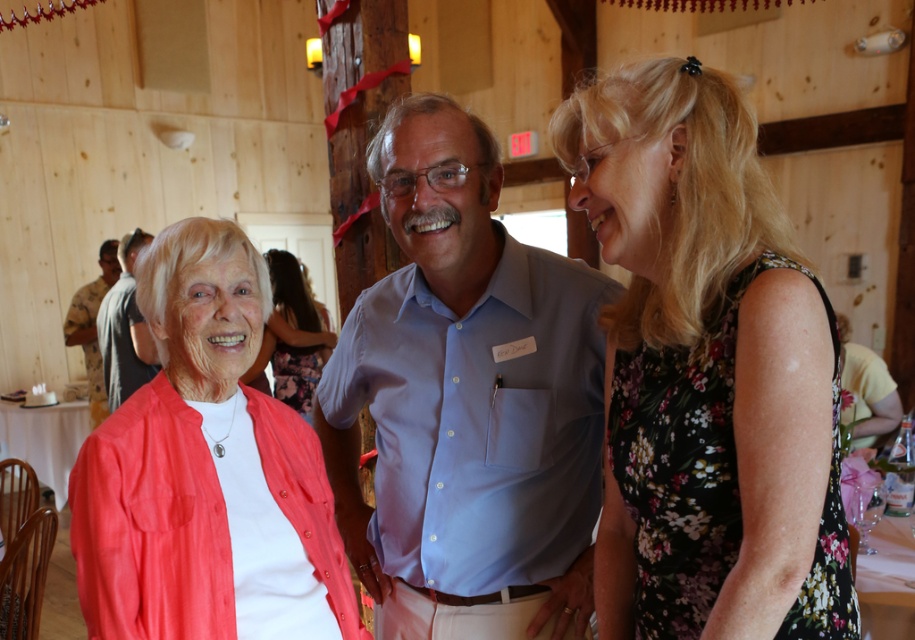
Which of these two, matte coral blouse at center or brushed metal jacket at left, stands shorter?

With less height is matte coral blouse at center.

Does matte coral blouse at center appear over brushed metal jacket at left?

No.

This screenshot has height=640, width=915. What do you see at coordinates (201, 465) in the screenshot? I see `matte coral blouse at center` at bounding box center [201, 465].

The width and height of the screenshot is (915, 640). In order to click on matte coral blouse at center in this screenshot , I will do `click(201, 465)`.

Does matte coral blouse at center have a lesser width compared to matte coral cardigan at center?

Yes.

Is matte coral blouse at center to the right of matte coral cardigan at center from the viewer's perspective?

Indeed, matte coral blouse at center is positioned on the right side of matte coral cardigan at center.

Which is behind, point (109, 621) or point (274, 339)?

The point (274, 339) is behind.

At what (x,y) coordinates should I click in order to perform the action: click on matte coral blouse at center. Please return your answer as a coordinate pair (x, y). Looking at the image, I should click on (201, 465).

This screenshot has height=640, width=915. Describe the element at coordinates (466, 400) in the screenshot. I see `light blue cotton shirt at center` at that location.

Between point (434, 218) and point (274, 444), which one is positioned in front?

Point (434, 218) is in front.

Who is more distant from viewer, (352,472) or (97,572)?

The point (352,472) is more distant.

I want to click on light blue cotton shirt at center, so click(466, 400).